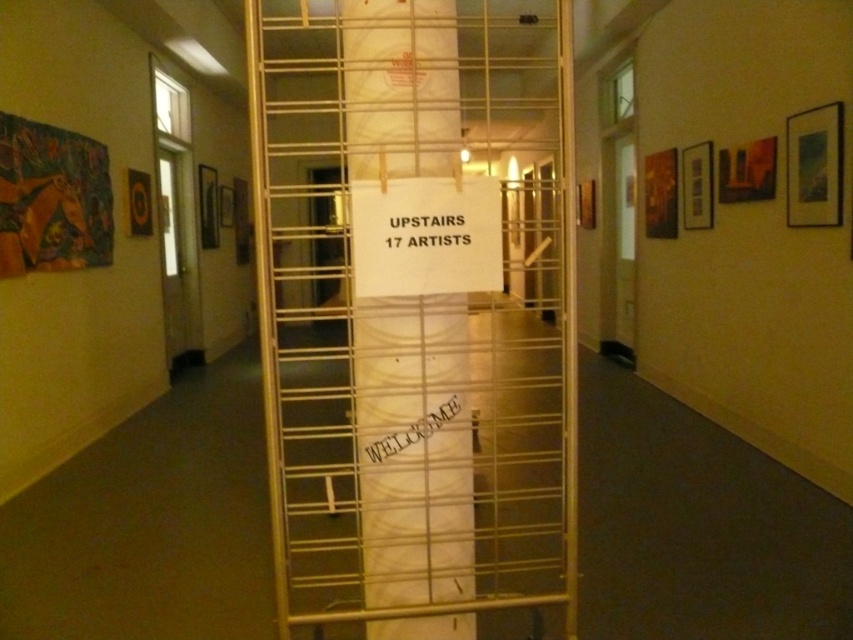
Question: Does gold metal scaffolding at center lie behind white paper at center?

Choices:
 (A) no
 (B) yes

Answer: (B)

Question: Observing the image, what is the correct spatial positioning of gold metal scaffolding at center in reference to white paper at center?

Choices:
 (A) above
 (B) below

Answer: (A)

Question: Does gold metal scaffolding at center lie behind white paper at center?

Choices:
 (A) yes
 (B) no

Answer: (A)

Question: Which point is farther from the camera taking this photo?

Choices:
 (A) (372, 428)
 (B) (445, 216)

Answer: (A)

Question: Which of the following is the farthest from the observer?

Choices:
 (A) white paper at center
 (B) gold metal scaffolding at center

Answer: (B)